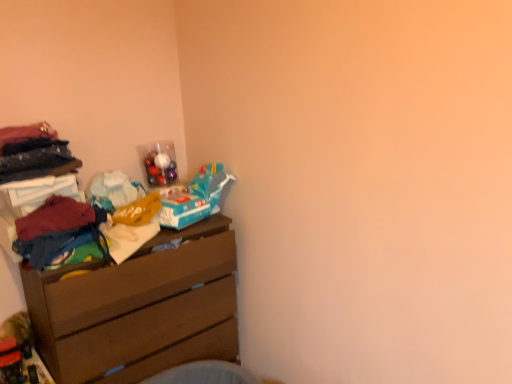
Locate an element on the screen. Image resolution: width=512 pixels, height=384 pixels. free point above multicolored fabric at left (from a real-world perspective) is located at coordinates (59, 217).